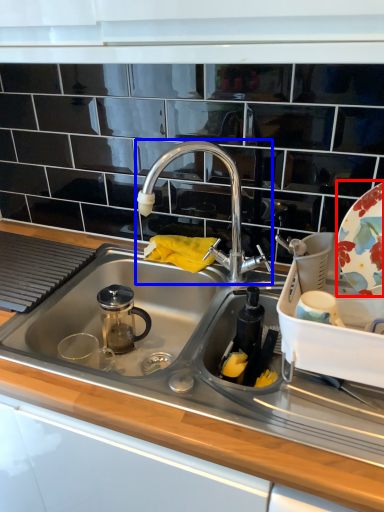
Question: Which object is further to the camera taking this photo, platter (highlighted by a red box) or tap (highlighted by a blue box)?

Choices:
 (A) platter
 (B) tap

Answer: (B)